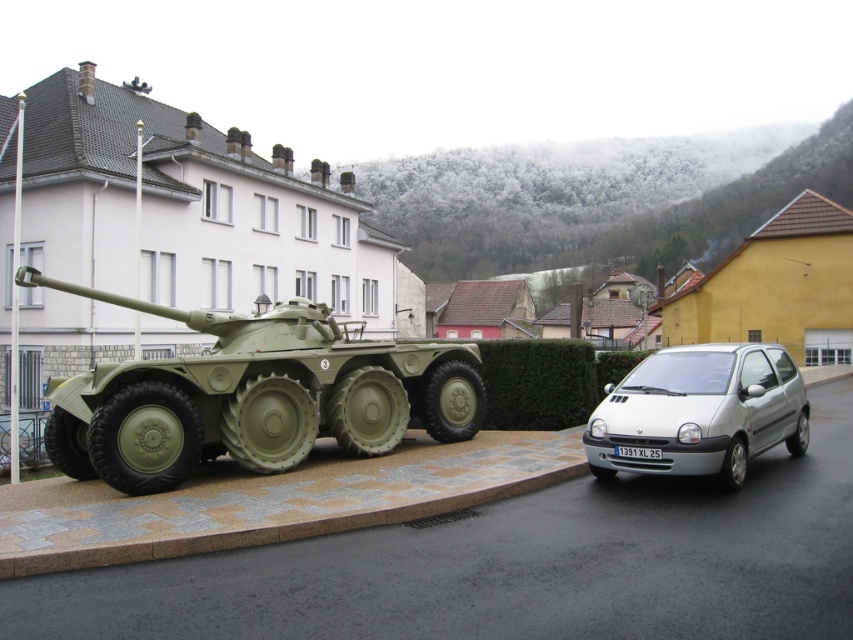
Which is more to the left, silver metallic hatchback at right or white plastic license plate at center?

white plastic license plate at center is more to the left.

Is point (776, 380) positioned before point (630, 449)?

No, (776, 380) is behind (630, 449).

Locate an element on the screen. silver metallic hatchback at right is located at coordinates (700, 412).

Describe the element at coordinates (253, 396) in the screenshot. I see `matte green tank at center` at that location.

Which is in front, point (61, 435) or point (688, 404)?

Point (688, 404)

Locate an element on the screen. The height and width of the screenshot is (640, 853). matte green tank at center is located at coordinates (253, 396).

Can you confirm if matte green tank at center is positioned to the right of white plastic license plate at center?

Incorrect, matte green tank at center is not on the right side of white plastic license plate at center.

Is matte green tank at center wider than white plastic license plate at center?

No.

Which is in front, point (113, 428) or point (618, 454)?

Positioned in front is point (113, 428).

Where is `matte green tank at center`? This screenshot has height=640, width=853. matte green tank at center is located at coordinates [253, 396].